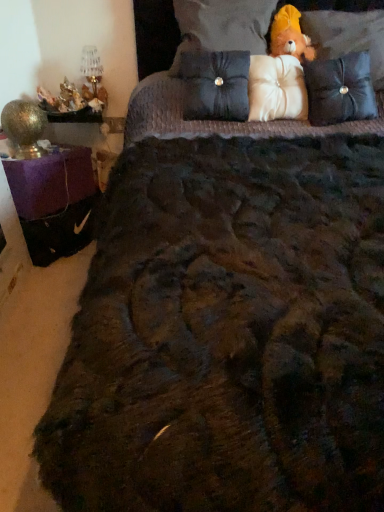
Question: Should I look upward or downward to see white fabric pillow at center, acting as the 3th pillow starting from the left?

Choices:
 (A) up
 (B) down

Answer: (A)

Question: Is velvet black pillow at upper right, which ranks as the first pillow in right-to-left order, positioned in front of velvet-like brown pillow at upper right, the fourth pillow positioned from the left?

Choices:
 (A) yes
 (B) no

Answer: (A)

Question: Does velvet black pillow at upper right, which ranks as the first pillow in right-to-left order, lie behind velvet-like brown pillow at upper right, the fourth pillow positioned from the left?

Choices:
 (A) no
 (B) yes

Answer: (A)

Question: From a real-world perspective, is velvet black pillow at upper right, which appears as the fifth pillow when viewed from the left, located higher than velvet-like brown pillow at upper right, which is the second pillow in right-to-left order?

Choices:
 (A) no
 (B) yes

Answer: (B)

Question: From the image's perspective, is velvet black pillow at upper right, which ranks as the first pillow in right-to-left order, below velvet-like brown pillow at upper right, the fourth pillow positioned from the left?

Choices:
 (A) no
 (B) yes

Answer: (A)

Question: Is velvet black pillow at upper right, which appears as the fifth pillow when viewed from the left, taller than velvet-like brown pillow at upper right, the fourth pillow positioned from the left?

Choices:
 (A) no
 (B) yes

Answer: (B)

Question: Is velvet black pillow at upper right, which ranks as the first pillow in right-to-left order, placed right next to velvet-like brown pillow at upper right, the fourth pillow positioned from the left?

Choices:
 (A) no
 (B) yes

Answer: (A)

Question: From a real-world perspective, is white satin pillow at upper center, acting as the second pillow starting from the left, physically below velvet-like brown pillow at upper right, which is the second pillow in right-to-left order?

Choices:
 (A) no
 (B) yes

Answer: (A)

Question: Considering the relative sizes of white satin pillow at upper center, acting as the second pillow starting from the left, and velvet-like brown pillow at upper right, which is the second pillow in right-to-left order, in the image provided, is white satin pillow at upper center, acting as the second pillow starting from the left, bigger than velvet-like brown pillow at upper right, which is the second pillow in right-to-left order,?

Choices:
 (A) no
 (B) yes

Answer: (B)

Question: From the image's perspective, is white satin pillow at upper center, acting as the second pillow starting from the left, beneath velvet-like brown pillow at upper right, the fourth pillow positioned from the left?

Choices:
 (A) no
 (B) yes

Answer: (A)

Question: Considering the relative positions of white satin pillow at upper center, acting as the second pillow starting from the left, and velvet-like brown pillow at upper right, the fourth pillow positioned from the left, in the image provided, is white satin pillow at upper center, acting as the second pillow starting from the left, to the left of velvet-like brown pillow at upper right, the fourth pillow positioned from the left, from the viewer's perspective?

Choices:
 (A) yes
 (B) no

Answer: (A)

Question: Considering the relative sizes of white satin pillow at upper center, acting as the second pillow starting from the left, and velvet-like brown pillow at upper right, the fourth pillow positioned from the left, in the image provided, is white satin pillow at upper center, acting as the second pillow starting from the left, thinner than velvet-like brown pillow at upper right, the fourth pillow positioned from the left,?

Choices:
 (A) no
 (B) yes

Answer: (A)

Question: From a real-world perspective, is white satin pillow at upper center, which is the fourth pillow from right to left, positioned over velvet-like brown pillow at upper right, which is the second pillow in right-to-left order, based on gravity?

Choices:
 (A) yes
 (B) no

Answer: (A)

Question: From a real-world perspective, is white fabric pillow at center, the 3th pillow viewed from the right, on velvet-like brown pillow at upper right, which is the second pillow in right-to-left order?

Choices:
 (A) yes
 (B) no

Answer: (B)